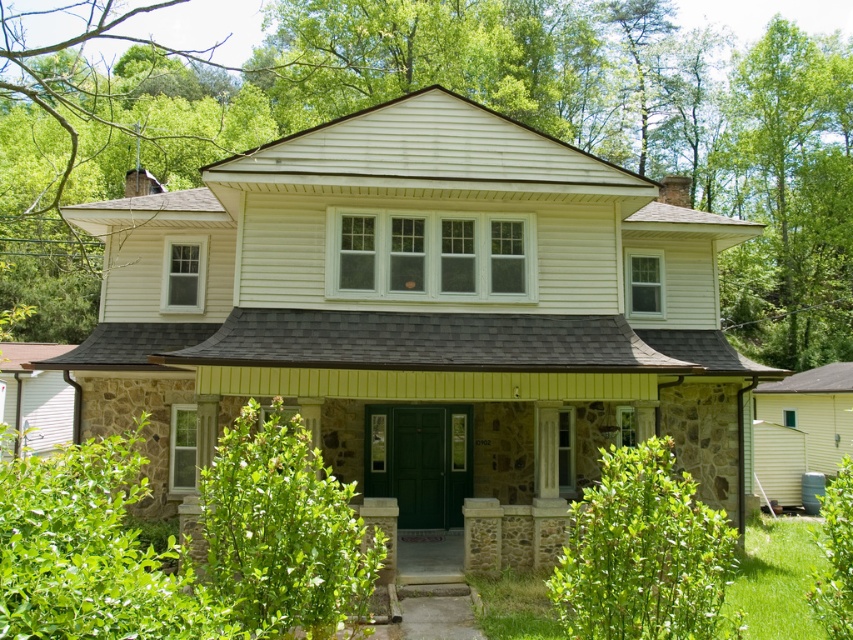
Question: Which object appears closest to the camera in this image?

Choices:
 (A) green leafy tree at upper right
 (B) green leafy tree at upper center

Answer: (B)

Question: Which object appears farthest from the camera in this image?

Choices:
 (A) green leafy tree at upper right
 (B) green leafy tree at upper center

Answer: (A)

Question: Does green leafy tree at upper center have a lesser width compared to green leafy tree at upper right?

Choices:
 (A) yes
 (B) no

Answer: (B)

Question: Which of the following is the closest to the observer?

Choices:
 (A) green leafy tree at upper center
 (B) green leafy tree at upper right

Answer: (A)

Question: Does green leafy tree at upper center have a smaller size compared to green leafy tree at upper right?

Choices:
 (A) yes
 (B) no

Answer: (B)

Question: Is green leafy tree at upper center above green leafy tree at upper right?

Choices:
 (A) yes
 (B) no

Answer: (A)